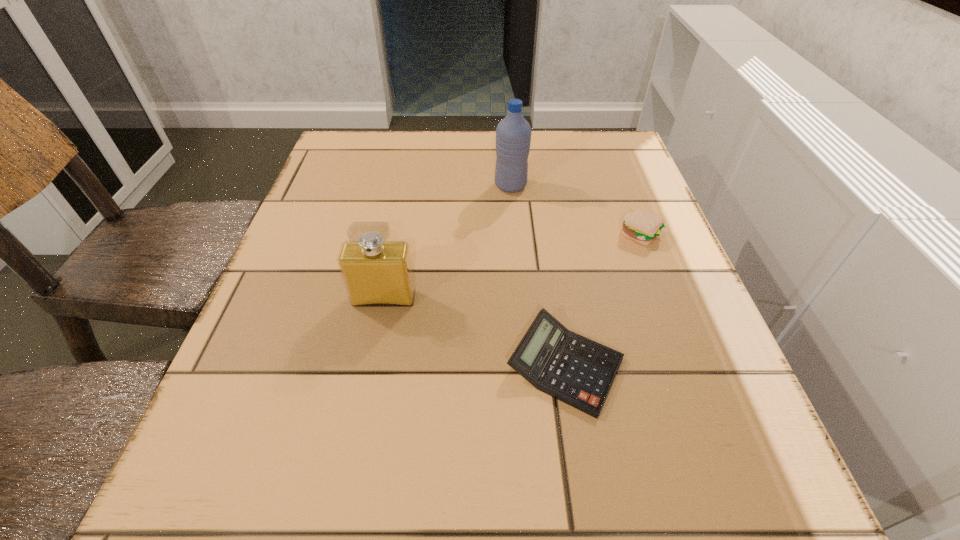
In the image, there is a desktop. What are the coordinates of `free region at the far right corner` in the screenshot? It's located at (619, 165).

Locate an element on the screen. free space at the near right corner of the desktop is located at coordinates (732, 479).

At what (x,y) coordinates should I click in order to perform the action: click on free area in between the calculator and the patty. Please return your answer as a coordinate pair (x, y). The height and width of the screenshot is (540, 960). Looking at the image, I should click on (603, 300).

Locate an element on the screen. The image size is (960, 540). blank region between the nearest object and the second tallest object is located at coordinates [x=474, y=332].

Where is `vacant space that is in between the tallest object and the calculator`? The image size is (960, 540). vacant space that is in between the tallest object and the calculator is located at coordinates (538, 276).

You are a GUI agent. You are given a task and a screenshot of the screen. Output one action in this format:
    pyautogui.click(x=<x>, y=<y>)
    Task: Click on the free space between the patty and the water bottle
    The width and height of the screenshot is (960, 540).
    Given the screenshot: What is the action you would take?
    pyautogui.click(x=576, y=210)

Locate an element on the screen. The height and width of the screenshot is (540, 960). vacant area between the third shortest object and the calculator is located at coordinates (474, 332).

You are a GUI agent. You are given a task and a screenshot of the screen. Output one action in this format:
    pyautogui.click(x=<x>, y=<y>)
    Task: Click on the vacant point located between the second tallest object and the nearest object
    This screenshot has width=960, height=540.
    Given the screenshot: What is the action you would take?
    pyautogui.click(x=474, y=332)

The image size is (960, 540). I want to click on free spot between the second tallest object and the patty, so click(513, 267).

Find the location of a particular element. The height and width of the screenshot is (540, 960). vacant space that is in between the water bottle and the nearest object is located at coordinates (538, 276).